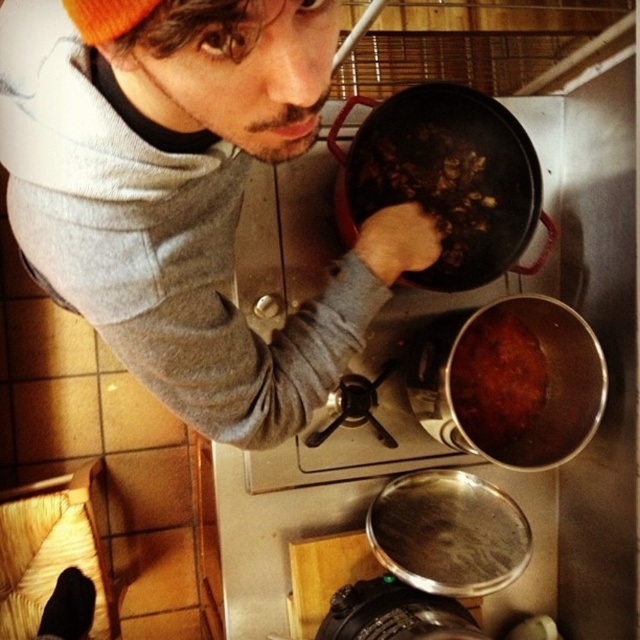
Question: Is matte gray sweater at upper left behind matte black frying pan at center?

Choices:
 (A) yes
 (B) no

Answer: (B)

Question: Among these points, which one is nearest to the camera?

Choices:
 (A) (422, 109)
 (B) (145, 141)
 (C) (460, 419)
 (D) (392, 157)

Answer: (B)

Question: Estimate the real-world distances between objects in this image. Which object is farther from the brown matte food at center?

Choices:
 (A) matte black frying pan at center
 (B) brown matte pot at lower right
 (C) matte gray sweater at upper left

Answer: (C)

Question: Does matte black frying pan at center appear on the right side of brown matte pot at lower right?

Choices:
 (A) yes
 (B) no

Answer: (B)

Question: Is matte gray sweater at upper left below brown matte food at center?

Choices:
 (A) yes
 (B) no

Answer: (A)

Question: Which object appears farthest from the camera in this image?

Choices:
 (A) brown matte food at center
 (B) brown matte pot at lower right
 (C) matte black frying pan at center
 (D) matte gray sweater at upper left

Answer: (A)